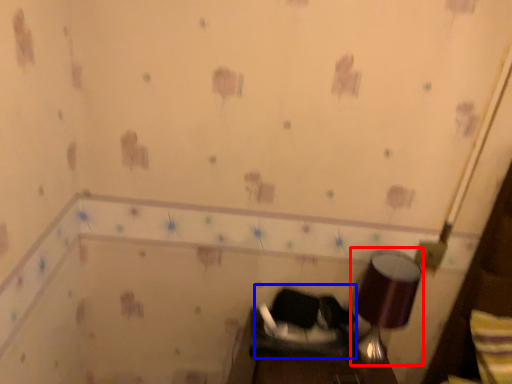
Question: Which object is further to the camera taking this photo, lamp (highlighted by a red box) or swivel chair (highlighted by a blue box)?

Choices:
 (A) lamp
 (B) swivel chair

Answer: (B)